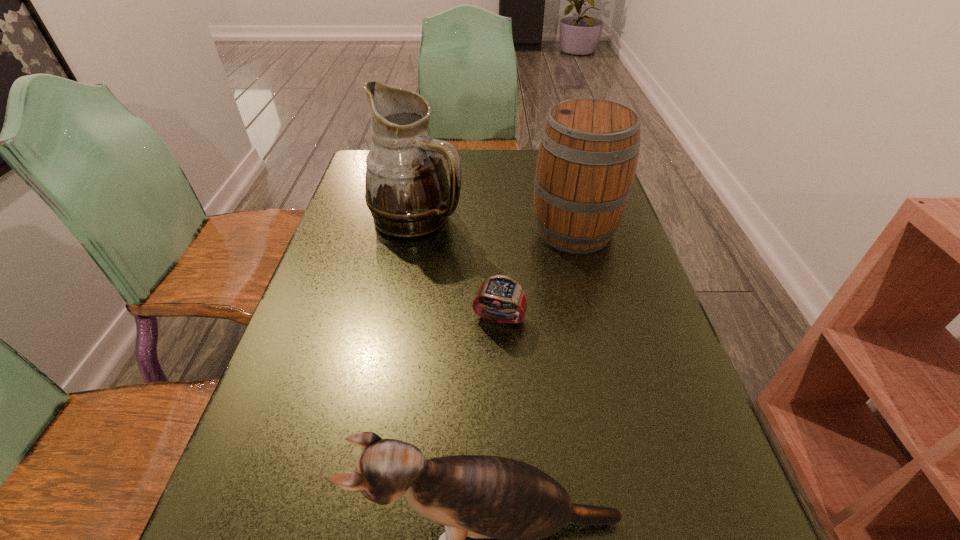
I want to click on free location that satisfies the following two spatial constraints: 1. from the spout of the pitcher; 2. on the right side of the watch, so click(399, 319).

What are the coordinates of `vacant area that satisfies the following two spatial constraints: 1. from the spout of the cider; 2. on the left side of the pitcher` in the screenshot? It's located at (416, 230).

Identify the location of vacant region that satisfies the following two spatial constraints: 1. from the spout of the pitcher; 2. on the left side of the watch. This screenshot has height=540, width=960. point(399,319).